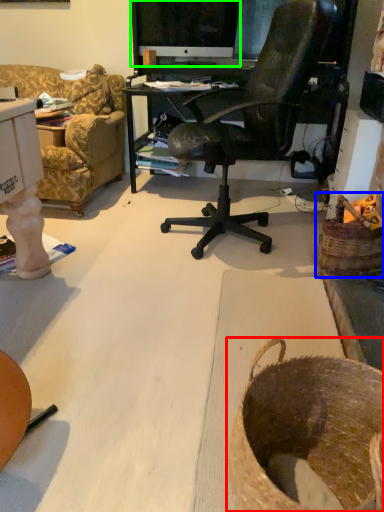
Question: Estimate the real-world distances between objects in this image. Which object is closer to basket (highlighted by a red box), basket (highlighted by a blue box) or computer monitor (highlighted by a green box)?

Choices:
 (A) basket
 (B) computer monitor

Answer: (A)